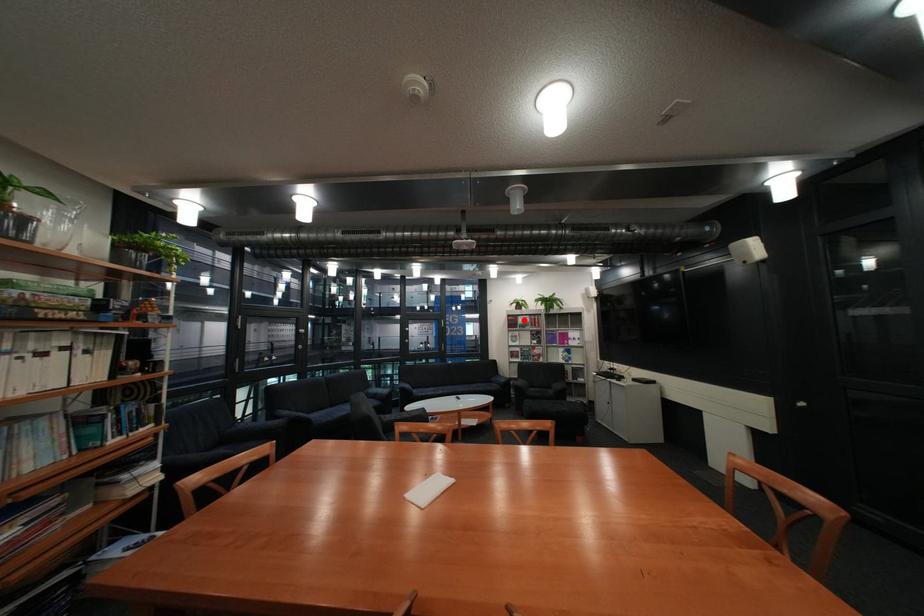
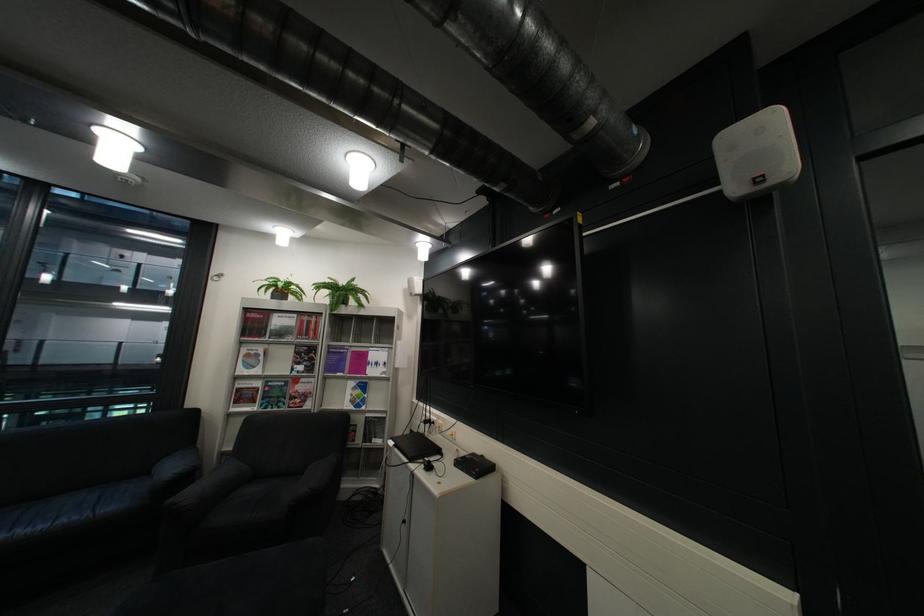
Locate, in the second image, the point that corresponds to the highlighted location in the first image.

(260, 320)